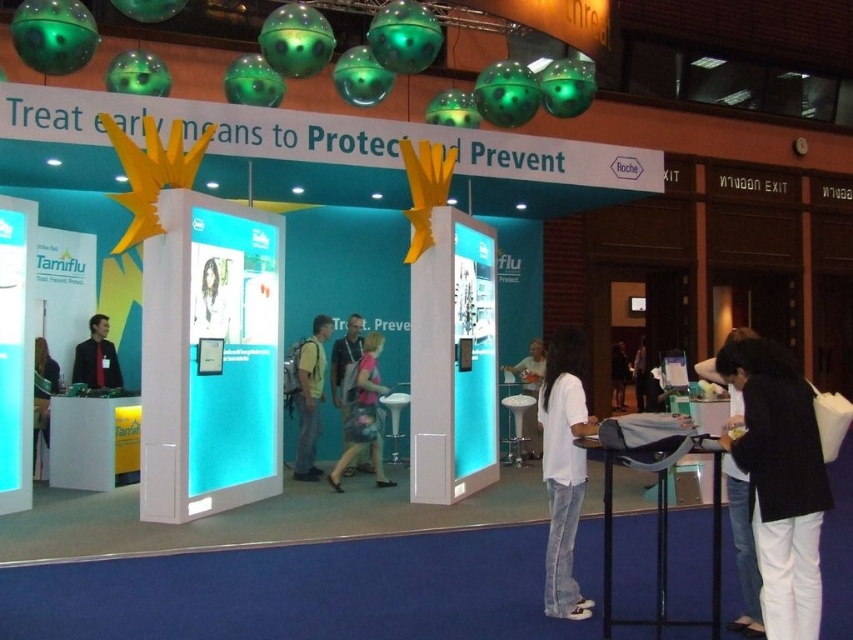
You are a photographer setting up for a photoshoot at the exhibition booth. You want to capture both the white cotton shirt at center and the floral fabric dress at center in your shot. Based on their positions, which one is closer to the camera?

The white cotton shirt at center is located above the floral fabric dress at center, so it is closer to the camera.

You are a photographer setting up a shoot in the exhibition booth. You have a floral fabric dress at center and a matte black jacket at center. Which item should you focus on if you want to capture the widest part of the clothing items?

The floral fabric dress at center might be wider than matte black jacket at center, so focusing on the floral fabric dress at center would capture the widest part.